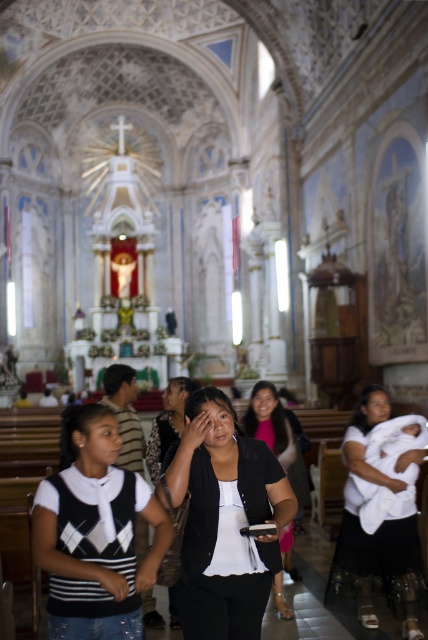
Is white knit sweater at center behind white cloth at center?

No, it is in front of white cloth at center.

Is white knit sweater at center to the left of white cloth at center from the viewer's perspective?

Yes, white knit sweater at center is to the left of white cloth at center.

Which is in front, point (83, 461) or point (344, 595)?

Point (83, 461) is in front.

Find the location of a particular element. Image resolution: width=428 pixels, height=640 pixels. white knit sweater at center is located at coordinates (95, 532).

From the picture: Who is more distant from viewer, (183, 586) or (249, 417)?

The point (249, 417) is more distant.

Identify the location of black matte shirt at center. This screenshot has height=640, width=428. (225, 520).

Based on the photo, who is more forward, (228, 465) or (305, 481)?

Point (228, 465)

You are a GUI agent. You are given a task and a screenshot of the screen. Output one action in this format:
    pyautogui.click(x=<x>, y=<y>)
    Task: Click on the black matte shirt at center
    The width and height of the screenshot is (428, 640).
    Given the screenshot: What is the action you would take?
    pyautogui.click(x=225, y=520)

Who is higher up, white knit sweater at center or matte black shirt at center?

white knit sweater at center is above.

Can you confirm if white knit sweater at center is positioned to the left of matte black shirt at center?

Correct, you'll find white knit sweater at center to the left of matte black shirt at center.

Does point (88, 627) come farther from viewer compared to point (154, 442)?

That is False.

The height and width of the screenshot is (640, 428). Identify the location of white knit sweater at center. (95, 532).